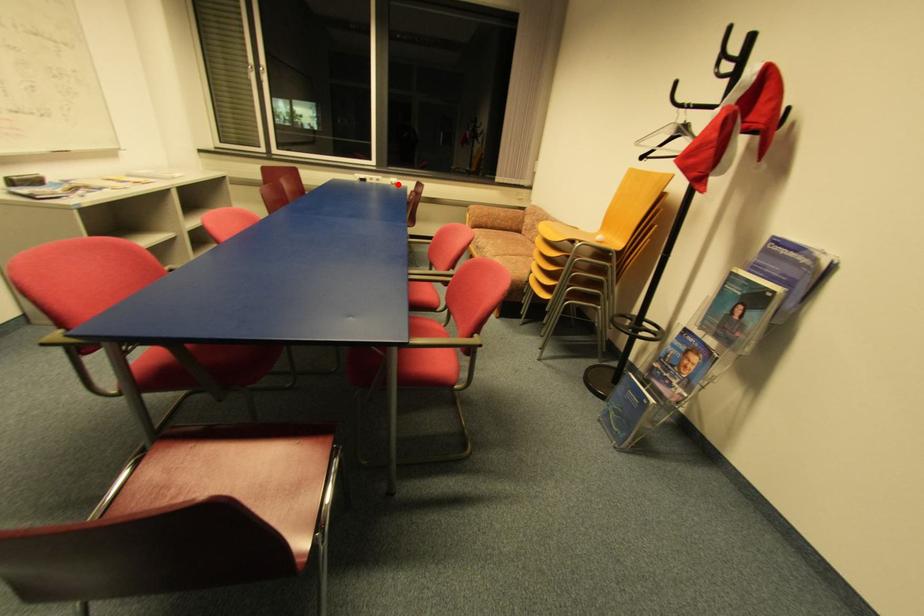
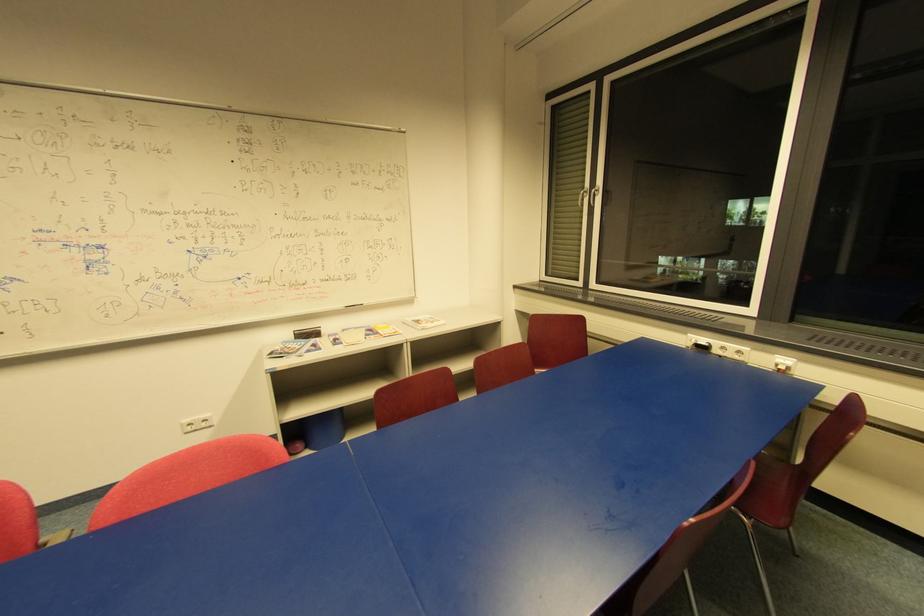
Locate, in the second image, the point that corresponds to the highlighted location in the first image.

(785, 369)